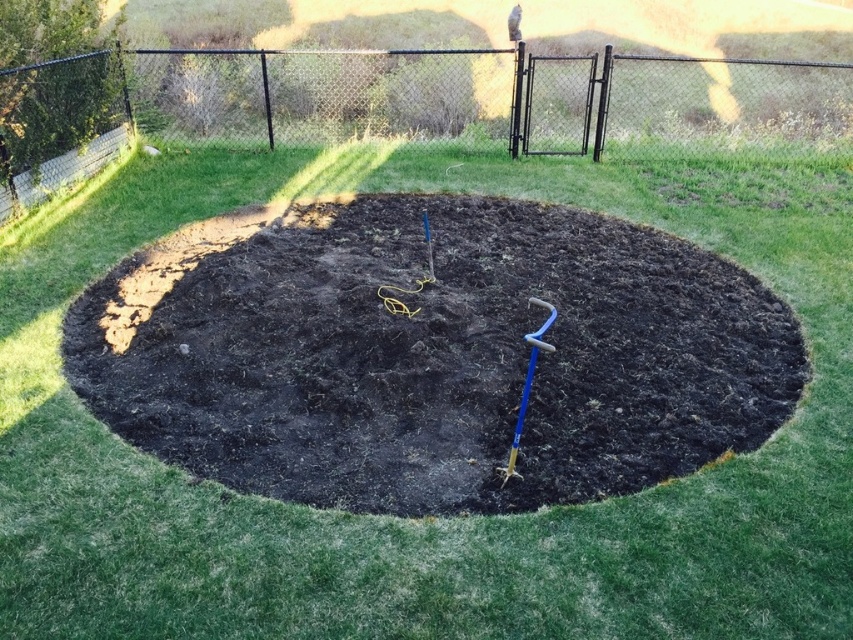
Which of these two, dark soil at center or blue plastic shovel at center, stands shorter?

Standing shorter between the two is blue plastic shovel at center.

Who is more forward, (x=590, y=269) or (x=543, y=349)?

Point (x=543, y=349) is in front.

Image resolution: width=853 pixels, height=640 pixels. What do you see at coordinates (432, 353) in the screenshot?
I see `dark soil at center` at bounding box center [432, 353].

Where is `dark soil at center`? This screenshot has width=853, height=640. dark soil at center is located at coordinates (432, 353).

Who is positioned more to the left, black chain-link fence at upper center or blue plastic shovel at center?

From the viewer's perspective, blue plastic shovel at center appears more on the left side.

Who is more forward, (x=111, y=140) or (x=527, y=372)?

Point (x=527, y=372) is in front.

Who is more distant from viewer, (643, 74) or (532, 339)?

The point (643, 74) is behind.

The width and height of the screenshot is (853, 640). I want to click on black chain-link fence at upper center, so click(421, 104).

Does dark soil at center lie in front of black chain-link fence at upper center?

Yes, dark soil at center is closer to the viewer.

What do you see at coordinates (432, 353) in the screenshot? The width and height of the screenshot is (853, 640). I see `dark soil at center` at bounding box center [432, 353].

The width and height of the screenshot is (853, 640). What are the coordinates of `dark soil at center` in the screenshot? It's located at (432, 353).